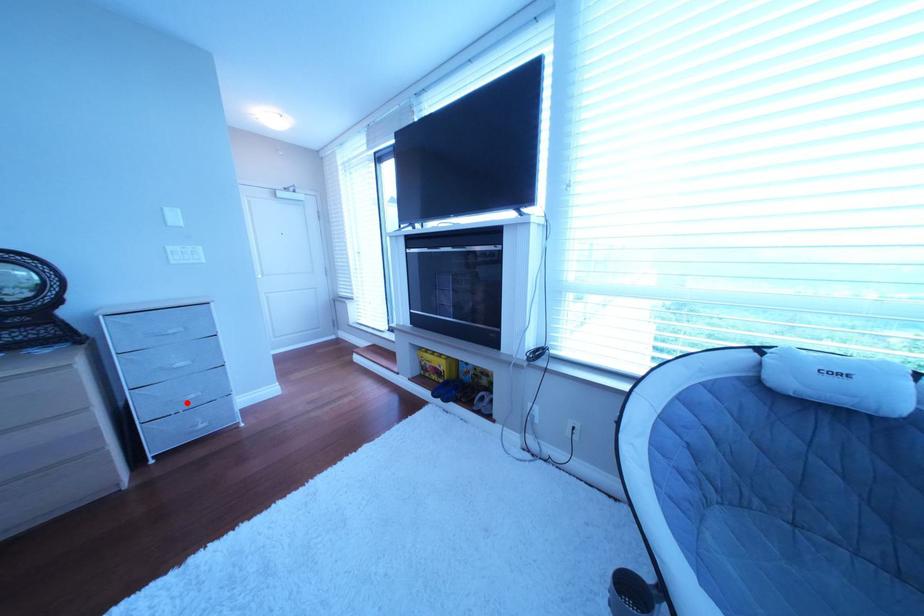
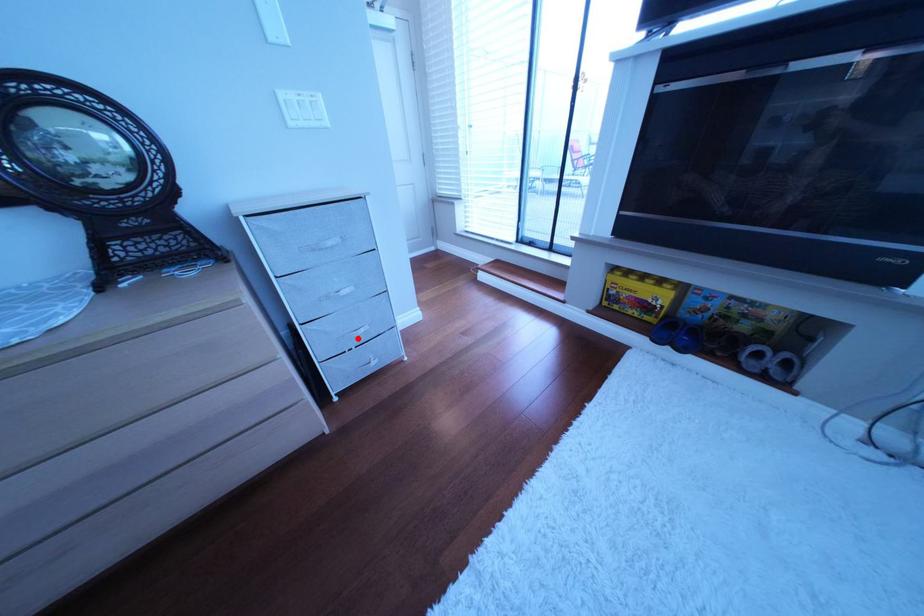
I am providing you with two images of the same scene from different viewpoints. A red point is marked on the first image and another point is marked on the second image. Are the points marked in image1 and image2 representing the same 3D position?

Yes